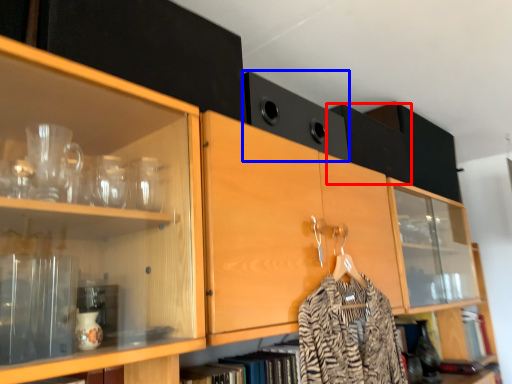
Question: Which object is further to the camera taking this photo, cabinetry (highlighted by a red box) or cabinetry (highlighted by a blue box)?

Choices:
 (A) cabinetry
 (B) cabinetry

Answer: (A)